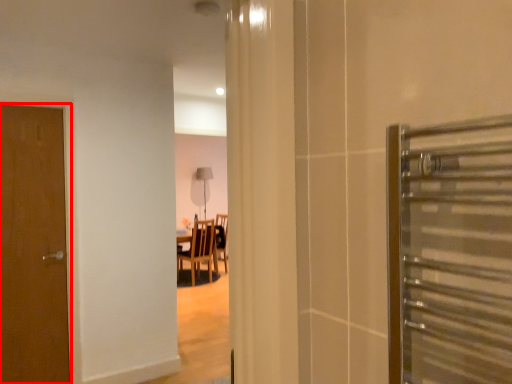
Question: From the image's perspective, considering the relative positions of door (annotated by the red box) and chair in the image provided, where is door (annotated by the red box) located with respect to the staircase?

Choices:
 (A) above
 (B) below

Answer: (A)